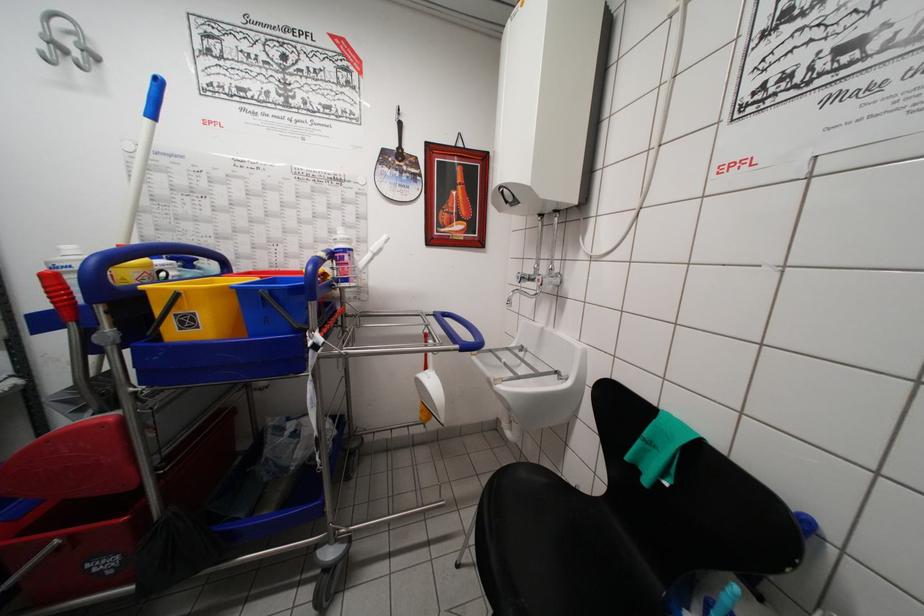
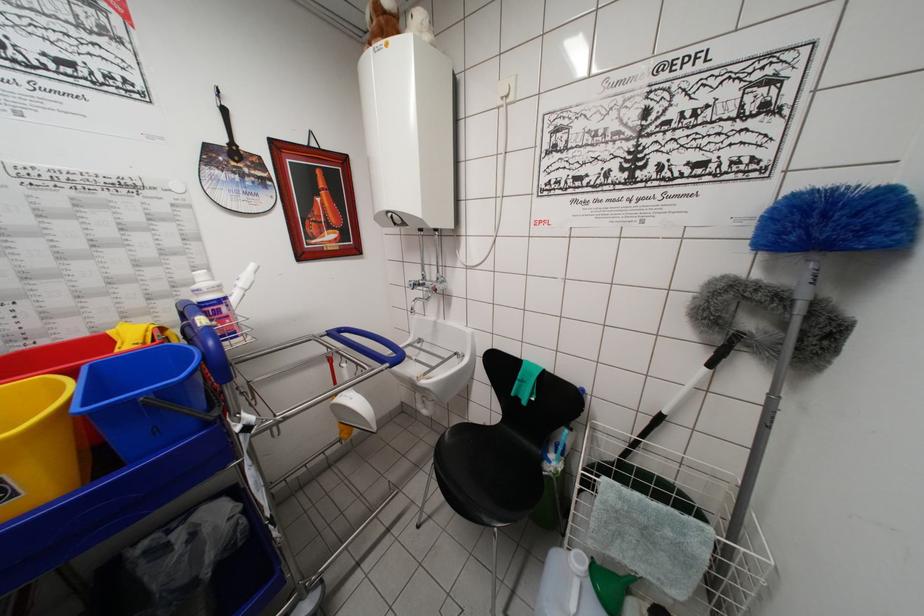
Find the pixel in the second image that matches the point at 201,333 in the first image.

(20, 500)